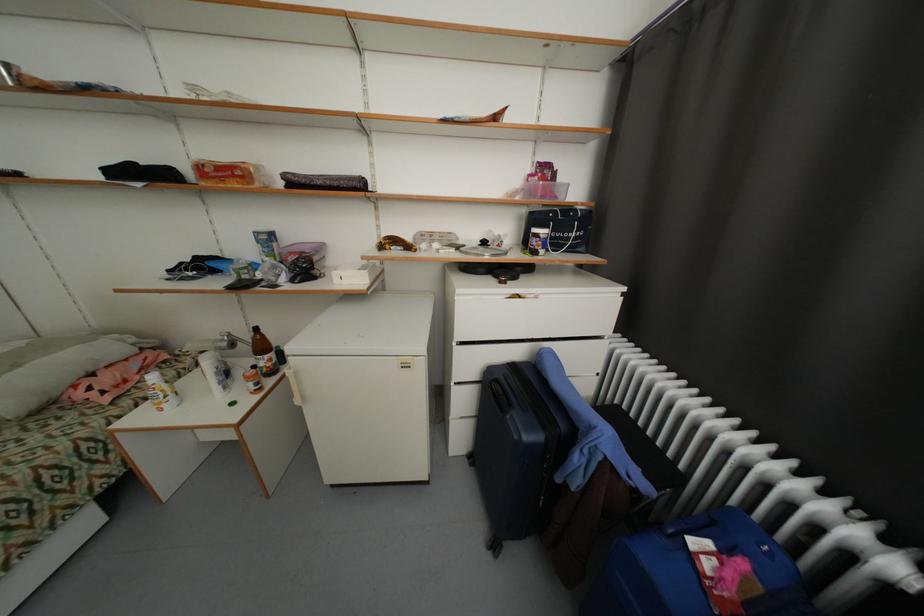
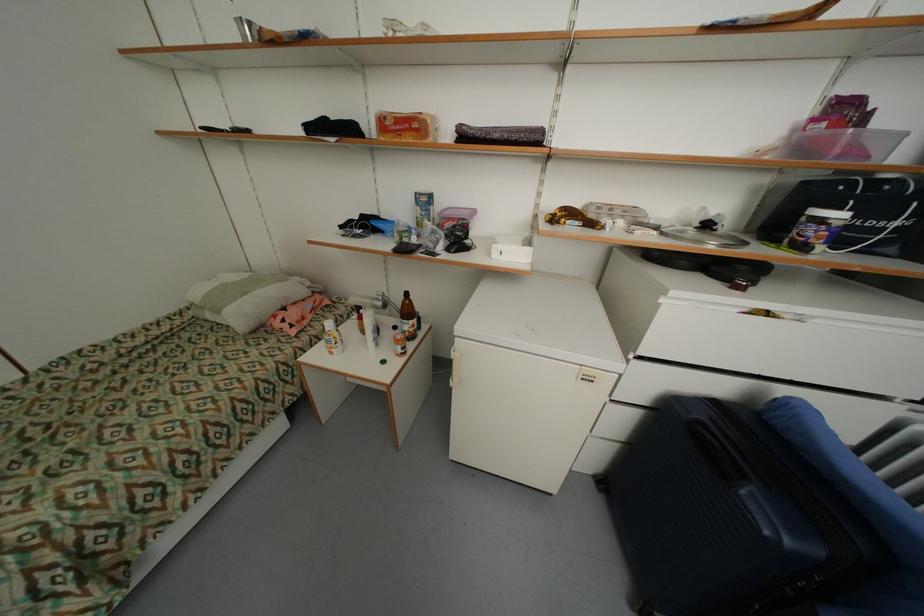
Locate, in the second image, the point that corresponds to point (504, 387) in the first image.

(715, 437)